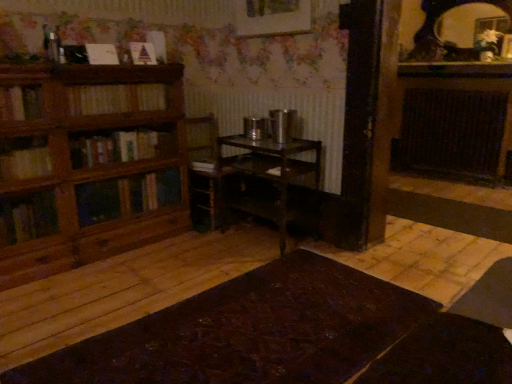
Identify the location of vacant space to the right of wooden bookshelf at left. The image size is (512, 384). (180, 261).